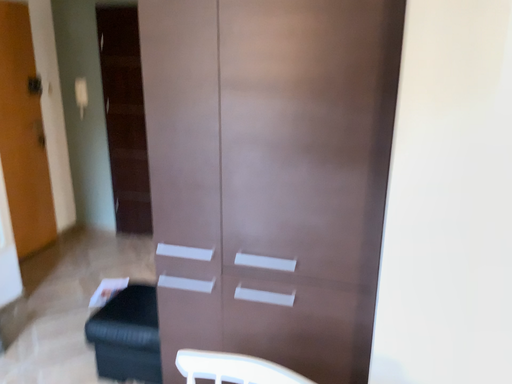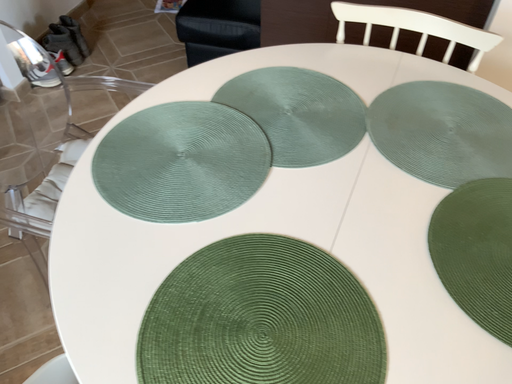
Question: How did the camera likely rotate when shooting the video?

Choices:
 (A) rotated upward
 (B) rotated downward

Answer: (B)